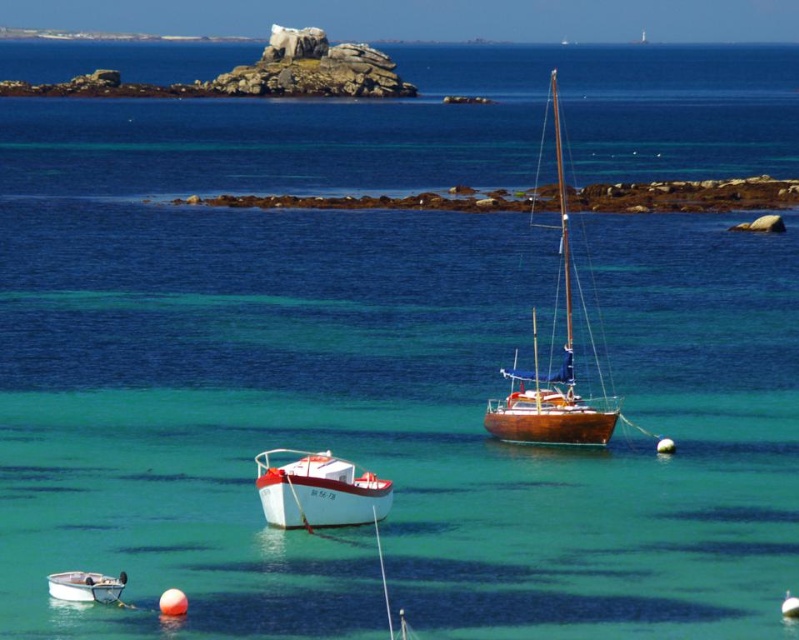
You are a drone operator planning to fly a drone from point A to point B in the coastal scene. The coordinates for point A are point (591, 340) and point B are point (58, 593). Considering the spatial relationship between these points, which point is closer to the drone when it starts at point A?

Point A is the starting point, so it is closer to the drone initially. However, if the question refers to their positions relative to the viewer, point (591, 340) is closer to the viewer than point (58, 593).

You are a marine biologist planning to use one of the boats for a short research trip. The white plastic boat at lower left has a maximum load capacity of 100 kg. If the white matte boat at center is wider, does that mean it can carry more weight?

The white matte boat at center might be wider than white plastic boat at lower left, but width alone does not determine load capacity. The maximum load capacity depends on factors like material and design, so we cannot assume it can carry more weight without additional information.